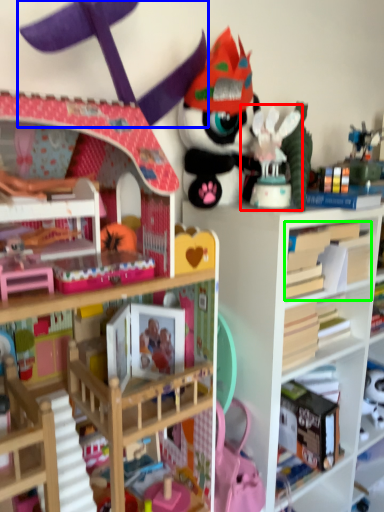
Question: Which is nearer to the toy (highlighted by a red box)? toy (highlighted by a blue box) or book (highlighted by a green box).

Choices:
 (A) toy
 (B) book

Answer: (B)